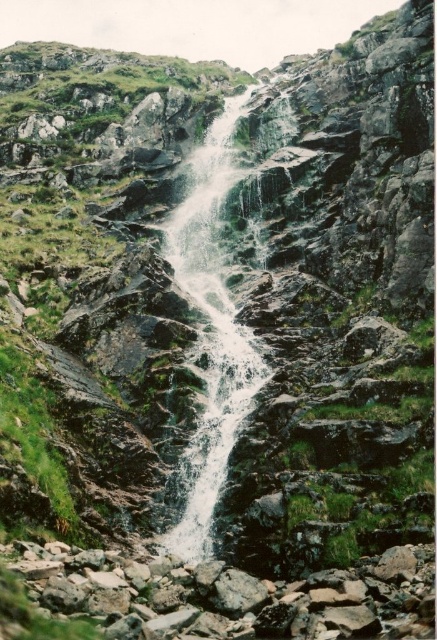
Question: Which point appears farthest from the camera in this image?

Choices:
 (A) (349, 577)
 (B) (194, 221)

Answer: (B)

Question: From the image, what is the correct spatial relationship of rocky boulder at center in relation to white frothy water at center?

Choices:
 (A) right
 (B) left

Answer: (A)

Question: Observing the image, what is the correct spatial positioning of rocky boulder at center in reference to white frothy water at center?

Choices:
 (A) right
 (B) left

Answer: (A)

Question: Can you confirm if rocky boulder at center is bigger than white frothy water at center?

Choices:
 (A) no
 (B) yes

Answer: (A)